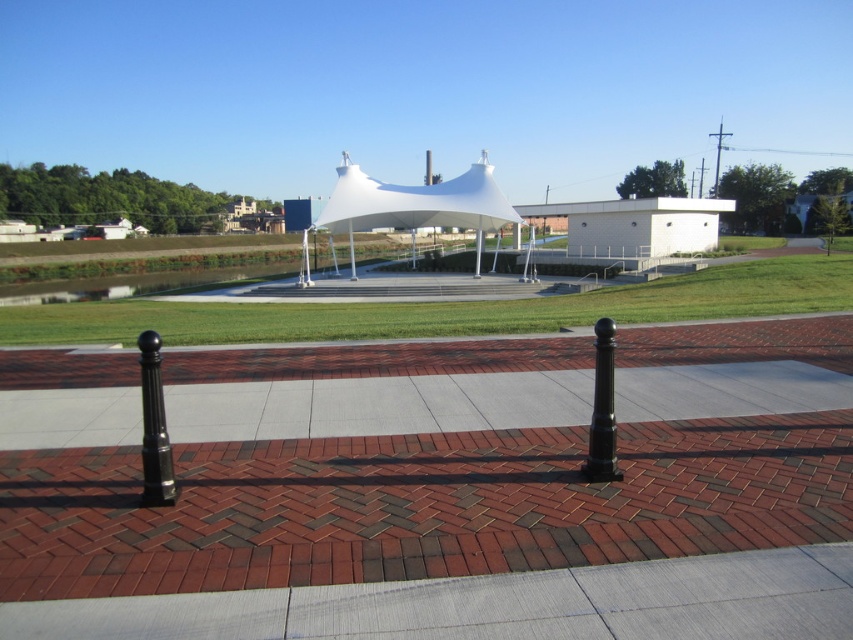
Is white fabric tent at center bigger than black polished post at center?

Indeed, white fabric tent at center has a larger size compared to black polished post at center.

Which of these two, white fabric tent at center or black polished post at center, stands shorter?

Standing shorter between the two is black polished post at center.

Where is `white fabric tent at center`? The image size is (853, 640). white fabric tent at center is located at coordinates (416, 204).

This screenshot has height=640, width=853. Find the location of `white fabric tent at center`. white fabric tent at center is located at coordinates (416, 204).

Between black polished metal post at left and black polished post at center, which one is positioned lower?

black polished post at center is below.

Can you confirm if black polished metal post at left is shorter than black polished post at center?

No.

At what (x,y) coordinates should I click in order to perform the action: click on black polished metal post at left. Please return your answer as a coordinate pair (x, y). Image resolution: width=853 pixels, height=640 pixels. Looking at the image, I should click on (154, 428).

Looking at this image, can you confirm if gray concrete pavement at center is positioned to the left of white fabric tent at center?

Incorrect, gray concrete pavement at center is not on the left side of white fabric tent at center.

Is gray concrete pavement at center positioned before white fabric tent at center?

That is True.

Identify the location of gray concrete pavement at center. (492, 604).